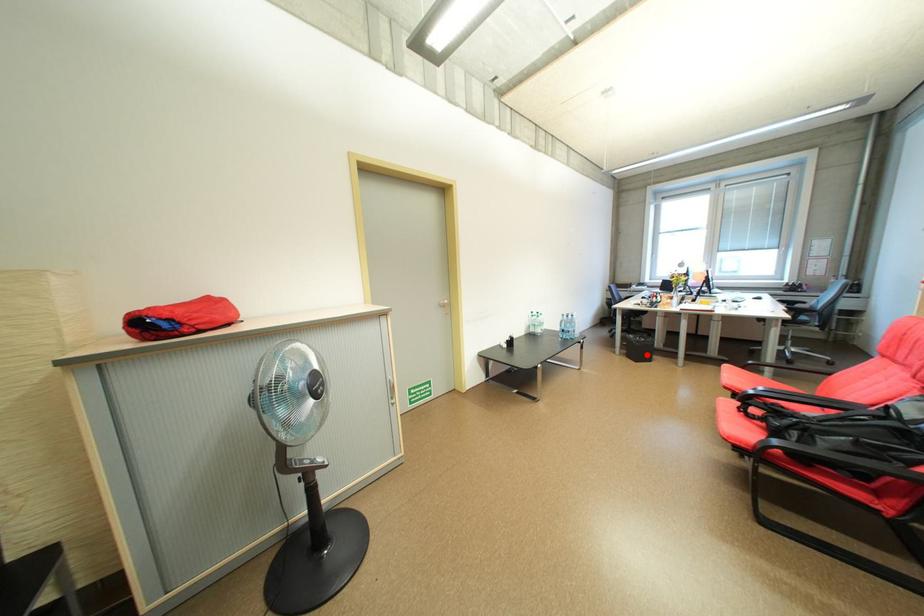
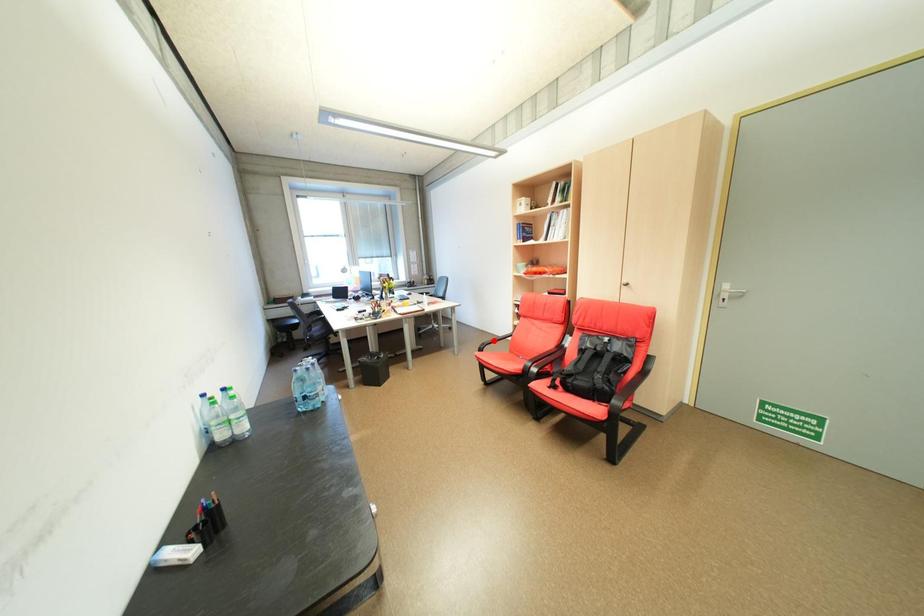
I am providing you with two images of the same scene from different viewpoints. A red point is marked on the first image and another point is marked on the second image. Do the highlighted points in image1 and image2 indicate the same real-world spot?

No